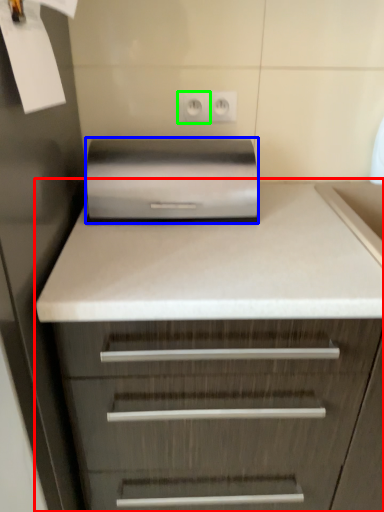
Question: Which object is positioned closest to chest of drawers (highlighted by a red box)? Select from home appliance (highlighted by a blue box) and electric outlet (highlighted by a green box).

Choices:
 (A) home appliance
 (B) electric outlet

Answer: (A)